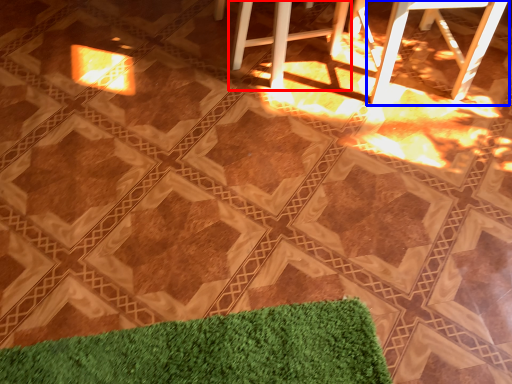
Question: Which point is further to the camera, bar stool (highlighted by a red box) or bar stool (highlighted by a blue box)?

Choices:
 (A) bar stool
 (B) bar stool

Answer: (A)